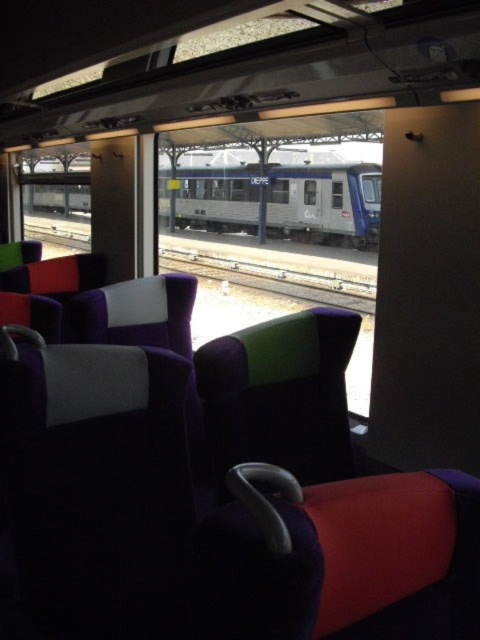
You are a passenger sitting on the purple fabric seat at center in the train carriage. You notice the metal train track at center outside the window. Which object is smaller in size?

The purple fabric seat at center is smaller in size compared to the metal train track at center.

You are a passenger sitting in the train carriage and want to look at the metal train track at center outside the window. Which side of the velvet green armrest at center should you look past to see it?

The metal train track at center is on the right side of the velvet green armrest at center, so you should look to the right of the velvet green armrest at center to see it.